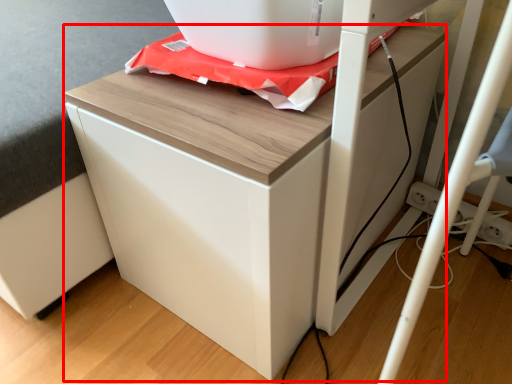
Question: Considering the relative positions of furniture (annotated by the red box) and appliance in the image provided, where is furniture (annotated by the red box) located with respect to the staircase?

Choices:
 (A) left
 (B) right

Answer: (A)